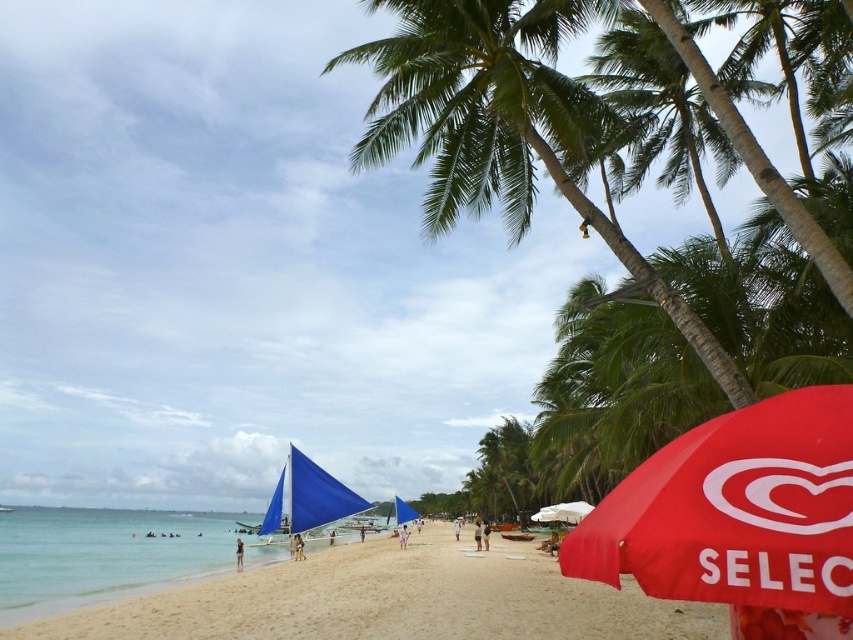
You are a photographer trying to capture a wide shot of the entire scene. You notice the beige sandy beach at lower center and the red fabric umbrella at lower right. Which object should you focus on to ensure both are in frame without cropping?

The beige sandy beach at lower center is much taller than the red fabric umbrella at lower right, so focusing on the taller beige sandy beach at lower center will ensure both are in frame without cropping.

You are a photographer standing at the edge of the beige sandy beach at lower center and want to take a picture of the red fabric umbrella at lower right. Which direction should you face to ensure the umbrella is in the frame?

The beige sandy beach at lower center is positioned on the left side of red fabric umbrella at lower right, so you should face to the right to capture the red fabric umbrella at lower right in your frame.